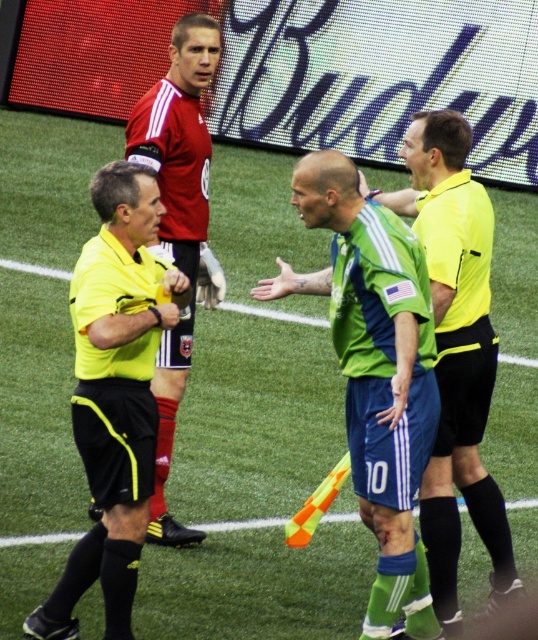
Question: Based on their relative distances, which object is nearer to the yellow/black uniform at center?

Choices:
 (A) green matte jersey at center
 (B) matte red jersey at upper center
 (C) yellow/black uniform at left

Answer: (A)

Question: Which point is farther to the camera?

Choices:
 (A) yellow/black uniform at left
 (B) green matte jersey at center
 (C) yellow/black uniform at center

Answer: (C)

Question: Does green matte jersey at center appear under yellow/black uniform at center?

Choices:
 (A) no
 (B) yes

Answer: (B)

Question: Is yellow/black uniform at left positioned behind matte red jersey at upper center?

Choices:
 (A) no
 (B) yes

Answer: (A)

Question: Considering the relative positions of yellow/black uniform at center and matte red jersey at upper center in the image provided, where is yellow/black uniform at center located with respect to matte red jersey at upper center?

Choices:
 (A) right
 (B) left

Answer: (A)

Question: Which point is closer to the camera taking this photo?

Choices:
 (A) (103, 564)
 (B) (442, 422)

Answer: (A)